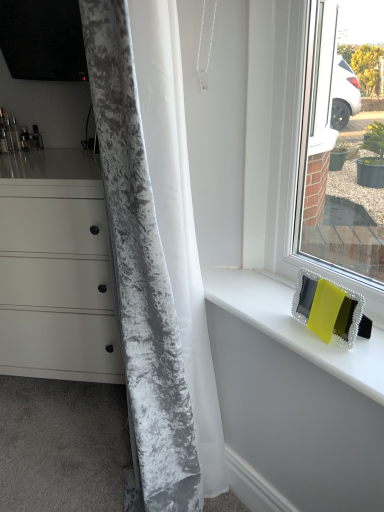
Where is `yellow fabric at upper right`? The image size is (384, 512). yellow fabric at upper right is located at coordinates (296, 327).

From the image's perspective, is matte yellow frame at right above or below velvet gray curtain at left?

From the image's perspective, matte yellow frame at right appears above velvet gray curtain at left.

Do you think matte yellow frame at right is within velvet gray curtain at left, or outside of it?

matte yellow frame at right is located beyond the bounds of velvet gray curtain at left.

Considering the relative sizes of matte yellow frame at right and velvet gray curtain at left in the image provided, is matte yellow frame at right shorter than velvet gray curtain at left?

Yes, matte yellow frame at right is shorter than velvet gray curtain at left.

Can you tell me how much matte yellow frame at right and velvet gray curtain at left differ in facing direction?

The angle between the facing direction of matte yellow frame at right and the facing direction of velvet gray curtain at left is 42.4 degrees.

From a real-world perspective, which is physically below, velvet gray curtain at left or yellow fabric at upper right?

yellow fabric at upper right is physically lower.

Is velvet gray curtain at left facing towards yellow fabric at upper right?

Yes, velvet gray curtain at left is facing yellow fabric at upper right.

Does velvet gray curtain at left appear on the right side of yellow fabric at upper right?

No, velvet gray curtain at left is not to the right of yellow fabric at upper right.

Are matte yellow frame at right and yellow fabric at upper right located far from each other?

That's not correct — matte yellow frame at right is a little close to yellow fabric at upper right.

Is matte yellow frame at right taller or shorter than yellow fabric at upper right?

Considering their sizes, matte yellow frame at right has more height than yellow fabric at upper right.

Does point (310, 234) come farther from viewer compared to point (370, 344)?

Yes, point (310, 234) is farther from viewer.

Based on the photo, are yellow fabric at upper right and matte yellow frame at right making contact?

yellow fabric at upper right is not next to matte yellow frame at right, and they're not touching.

How different are the orientations of yellow fabric at upper right and matte yellow frame at right in degrees?

They differ by 0.53 degrees in their facing directions.

Does point (288, 329) come behind point (328, 52)?

No, (288, 329) is closer to viewer.

Is yellow fabric at upper right turned away from matte yellow frame at right?

No, matte yellow frame at right is not at the back of yellow fabric at upper right.

Which object is closer to the camera taking this photo, matte white chest of drawers at left or yellow fabric at upper right?

yellow fabric at upper right is closer to the camera.

Considering the relative sizes of matte white chest of drawers at left and yellow fabric at upper right in the image provided, is matte white chest of drawers at left taller than yellow fabric at upper right?

Yes, matte white chest of drawers at left is taller than yellow fabric at upper right.

Considering the sizes of matte white chest of drawers at left and yellow fabric at upper right in the image, is matte white chest of drawers at left wider or thinner than yellow fabric at upper right?

Considering their sizes, matte white chest of drawers at left looks broader than yellow fabric at upper right.

Is point (193, 490) positioned after point (358, 234)?

That is False.

Is velvet gray curtain at left to the left or to the right of matte yellow frame at right in the image?

velvet gray curtain at left is to the left of matte yellow frame at right.

From the image's perspective, does velvet gray curtain at left appear lower than matte yellow frame at right?

Yes, from the image's perspective, velvet gray curtain at left is below matte yellow frame at right.

You are a GUI agent. You are given a task and a screenshot of the screen. Output one action in this format:
    pyautogui.click(x=<x>, y=<y>)
    Task: Click on the window that is above the velvet gray curtain at left (from a real-world perspective)
    This screenshot has width=384, height=512.
    Given the screenshot: What is the action you would take?
    pyautogui.click(x=326, y=162)

Which object is further away from the camera taking this photo, matte yellow frame at right or matte white chest of drawers at left?

matte white chest of drawers at left.

Measure the distance from matte yellow frame at right to matte white chest of drawers at left.

matte yellow frame at right is 35.11 inches from matte white chest of drawers at left.

Visually, is matte yellow frame at right positioned to the left or to the right of matte white chest of drawers at left?

matte yellow frame at right is to the right of matte white chest of drawers at left.

Does point (318, 7) come behind point (91, 263)?

No, it is in front of (91, 263).

In order to click on window above the velvet gray curtain at left (from a real-world perspective) in this screenshot , I will do `click(326, 162)`.

This screenshot has width=384, height=512. What are the coordinates of `curtain to the left of yellow fabric at upper right` in the screenshot? It's located at (142, 261).

When comparing their distances from velvet gray curtain at left, does matte white chest of drawers at left or yellow fabric at upper right seem closer?

yellow fabric at upper right is closer to velvet gray curtain at left.

Considering their positions, is matte white chest of drawers at left positioned closer to matte yellow frame at right than velvet gray curtain at left?

velvet gray curtain at left.

Which object lies nearer to the anchor point velvet gray curtain at left, matte white chest of drawers at left or matte yellow frame at right?

Among the two, matte yellow frame at right is located nearer to velvet gray curtain at left.

Estimate the real-world distances between objects in this image. Which object is further from velvet gray curtain at left, matte yellow frame at right or matte white chest of drawers at left?

matte white chest of drawers at left is further to velvet gray curtain at left.

When comparing their distances from matte yellow frame at right, does yellow fabric at upper right or matte white chest of drawers at left seem closer?

yellow fabric at upper right.

When comparing their distances from yellow fabric at upper right, does velvet gray curtain at left or matte white chest of drawers at left seem closer?

velvet gray curtain at left is positioned closer to the anchor yellow fabric at upper right.

From the image, which object appears to be farther from matte yellow frame at right, yellow fabric at upper right or velvet gray curtain at left?

velvet gray curtain at left is positioned further to the anchor matte yellow frame at right.

When comparing their distances from matte white chest of drawers at left, does yellow fabric at upper right or matte yellow frame at right seem closer?

yellow fabric at upper right is closer to matte white chest of drawers at left.

Locate an element on the screen. This screenshot has width=384, height=512. counter top situated between velvet gray curtain at left and matte yellow frame at right from left to right is located at coordinates (296, 327).

You are a GUI agent. You are given a task and a screenshot of the screen. Output one action in this format:
    pyautogui.click(x=<x>, y=<y>)
    Task: Click on the curtain between matte white chest of drawers at left and yellow fabric at upper right
    The height and width of the screenshot is (512, 384).
    Given the screenshot: What is the action you would take?
    pyautogui.click(x=142, y=261)

Image resolution: width=384 pixels, height=512 pixels. I want to click on curtain between matte white chest of drawers at left and matte yellow frame at right, so click(142, 261).

In order to click on counter top located between matte white chest of drawers at left and matte yellow frame at right in the left-right direction in this screenshot , I will do `click(296, 327)`.